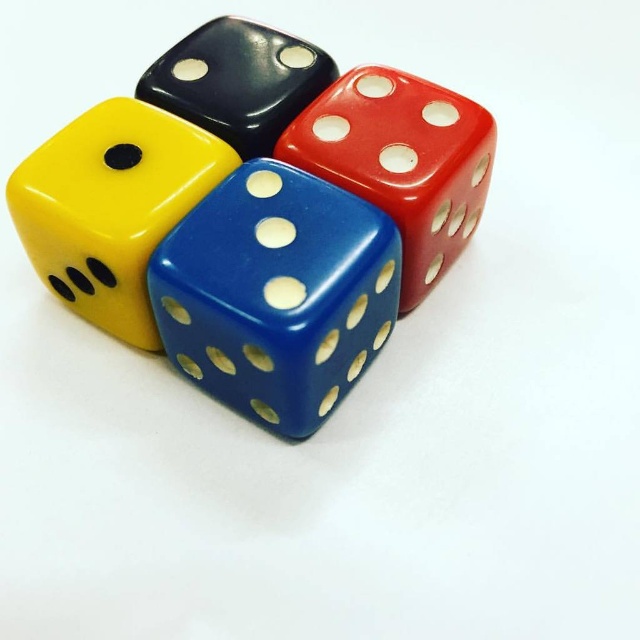
You are arranging dice for a game and notice two dice in the image. One is the glossy plastic dice at center and the other is the black glossy dice at upper center. From your perspective, which die is closer to you?

The glossy plastic dice at center is closer to you because it is in front of the black glossy dice at upper center.